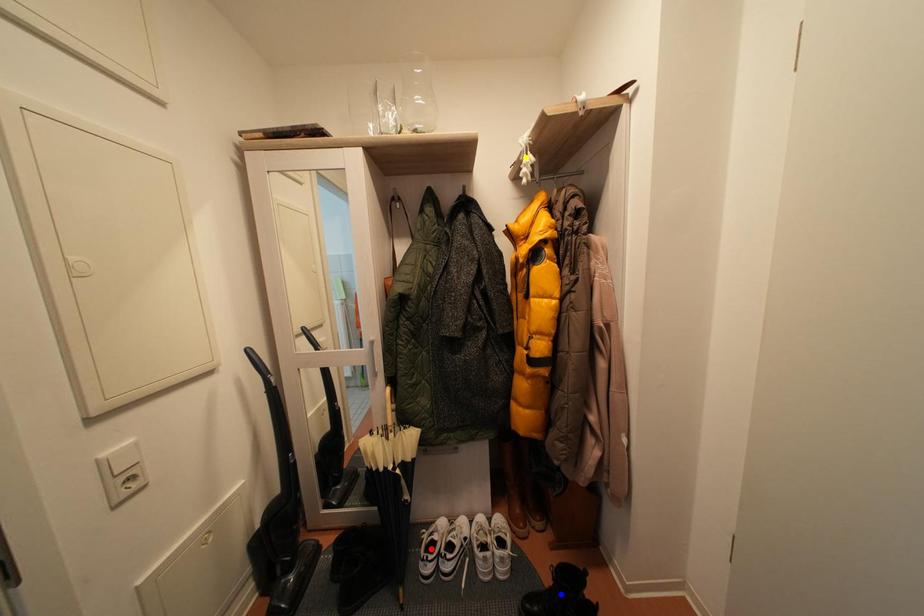
Order these from nearest to farthest:
- red point
- yellow point
- blue point

blue point, red point, yellow point